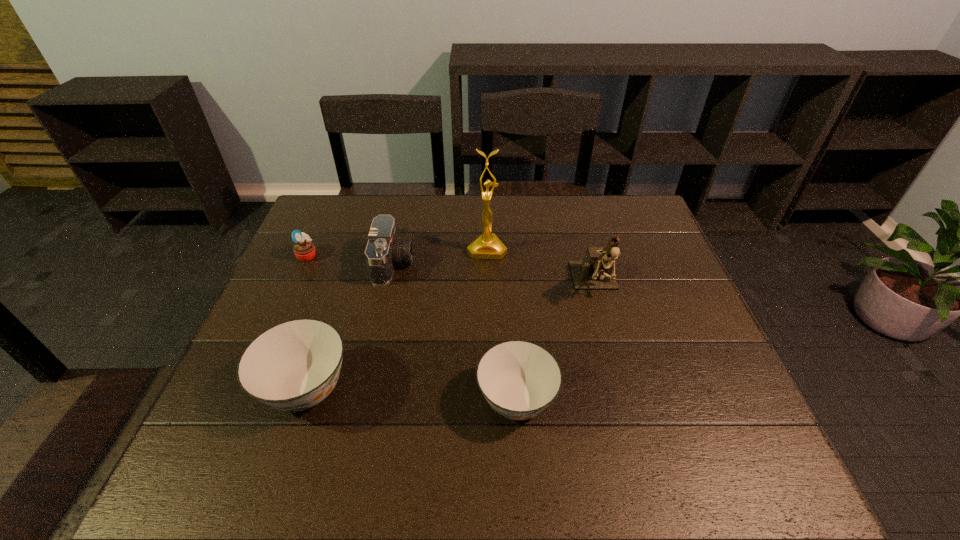
Where is `the third closest object to the award`? the third closest object to the award is located at coordinates (519, 379).

Locate which object ranks second in proximity to the camera. Please provide its 2D coordinates. Your answer should be formatted as a tuple, i.e. [(x, y)], where the tuple contains the x and y coordinates of a point satisfying the conditions above.

[(304, 250)]

In order to click on vacant position in the image that satisfies the following two spatial constraints: 1. on the front-facing side of the muffin; 2. on the back side of the left soup bowl in this screenshot , I will do `click(249, 388)`.

Where is `vacant space that satisfies the following two spatial constraints: 1. on the front-facing side of the camera; 2. on the front side of the taller soup bowl`? vacant space that satisfies the following two spatial constraints: 1. on the front-facing side of the camera; 2. on the front side of the taller soup bowl is located at coordinates (367, 388).

Identify the location of vacant space that satisfies the following two spatial constraints: 1. on the front-facing side of the camera; 2. on the back side of the shorter soup bowl. The width and height of the screenshot is (960, 540). (364, 400).

At what (x,y) coordinates should I click in order to perform the action: click on vacant space that satisfies the following two spatial constraints: 1. on the front-facing side of the shorter soup bowl; 2. on the left side of the award. Please return your answer as a coordinate pair (x, y). Looking at the image, I should click on (490, 400).